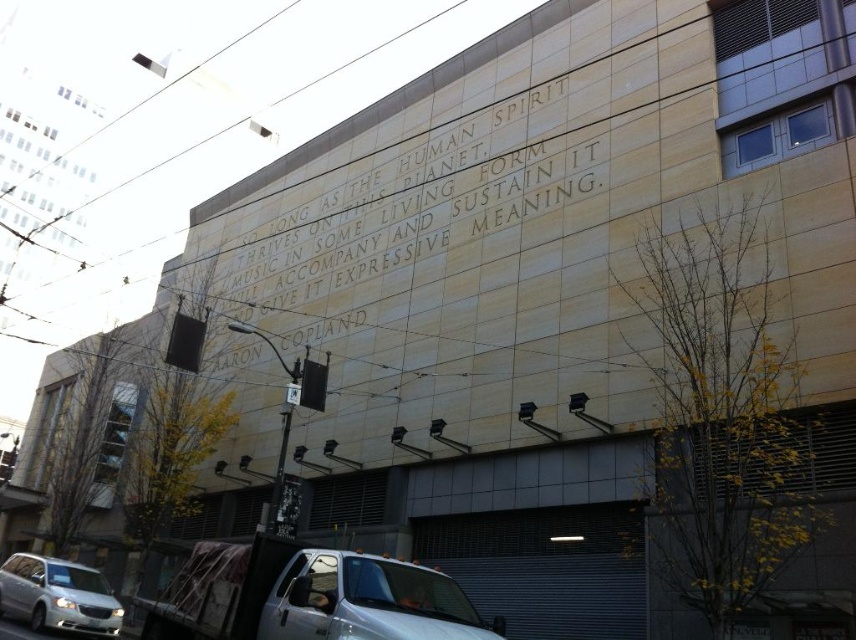
Question: Does white glossy truck at lower center have a larger size compared to white matte van at lower left?

Choices:
 (A) yes
 (B) no

Answer: (A)

Question: Where is white glossy truck at lower center located in relation to stone engraving at center in the image?

Choices:
 (A) left
 (B) right

Answer: (B)

Question: Among these objects, which one is nearest to the camera?

Choices:
 (A) white glossy truck at lower center
 (B) white matte van at lower left
 (C) stone engraving at center

Answer: (A)

Question: Estimate the real-world distances between objects in this image. Which object is farther from the stone engraving at center?

Choices:
 (A) white glossy truck at lower center
 (B) white matte van at lower left

Answer: (B)

Question: Does white matte van at lower left appear on the left side of stone engraving at center?

Choices:
 (A) yes
 (B) no

Answer: (A)

Question: Which object is the farthest from the white glossy truck at lower center?

Choices:
 (A) white matte van at lower left
 (B) stone engraving at center

Answer: (B)